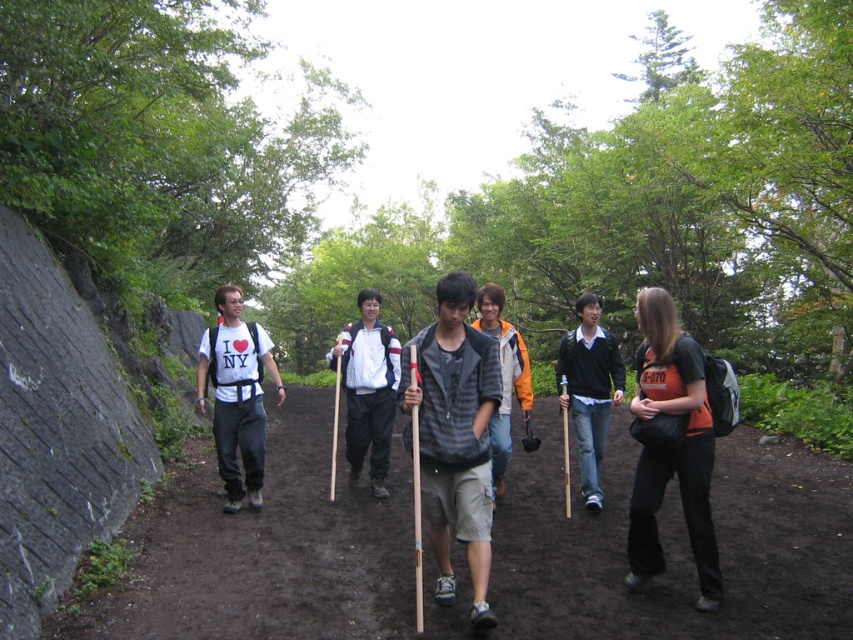
How far apart are gray fabric shirt at center and white matte jacket at center?

gray fabric shirt at center and white matte jacket at center are 6.91 feet apart from each other.

Between point (462, 365) and point (374, 353), which one is positioned behind?

Point (374, 353)

At what (x,y) coordinates should I click in order to perform the action: click on gray fabric shirt at center. Please return your answer as a coordinate pair (x, y). The image size is (853, 640). Looking at the image, I should click on (456, 435).

Does brown dirt path at center have a greater height compared to white matte jacket at center?

No.

Describe the element at coordinates (674, 544) in the screenshot. This screenshot has height=640, width=853. I see `brown dirt path at center` at that location.

You are a GUI agent. You are given a task and a screenshot of the screen. Output one action in this format:
    pyautogui.click(x=<x>, y=<y>)
    Task: Click on the brown dirt path at center
    
    Given the screenshot: What is the action you would take?
    click(674, 544)

Can you confirm if gray fabric shirt at center is positioned to the right of white matte t-shirt at center?

Correct, you'll find gray fabric shirt at center to the right of white matte t-shirt at center.

Does gray fabric shirt at center appear under white matte t-shirt at center?

Indeed, gray fabric shirt at center is positioned under white matte t-shirt at center.

Which is behind, point (476, 422) or point (242, 412)?

Positioned behind is point (242, 412).

Where is `gray fabric shirt at center`? The image size is (853, 640). gray fabric shirt at center is located at coordinates (456, 435).